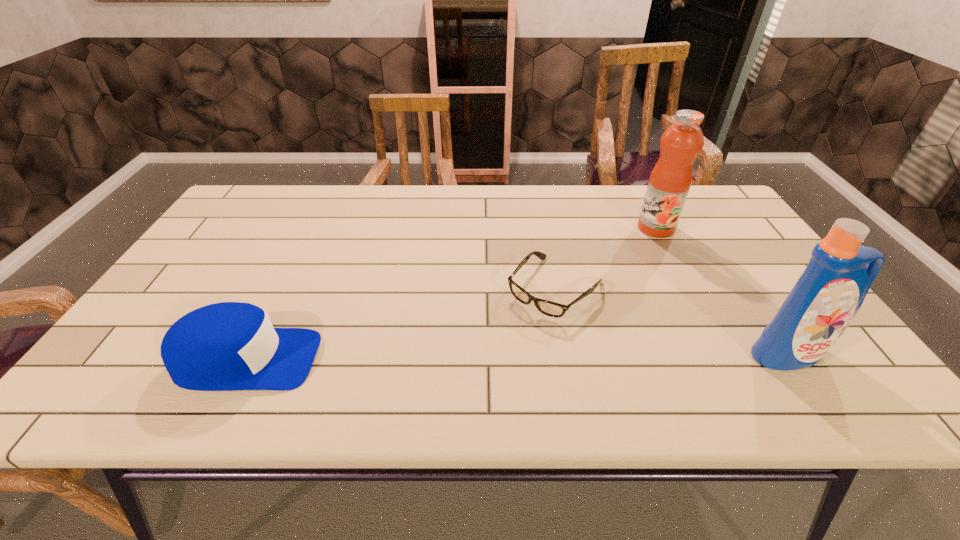
This screenshot has height=540, width=960. Identify the location of vacant spot on the desktop that is between the leftmost object and the rightmost object and is positioned on the front label of the third object from left to right. (540, 356).

This screenshot has height=540, width=960. Find the location of `free space on the desktop that is between the third tallest object and the rightmost object and is positioned on the front-facing side of the shortest object`. free space on the desktop that is between the third tallest object and the rightmost object and is positioned on the front-facing side of the shortest object is located at coordinates (491, 357).